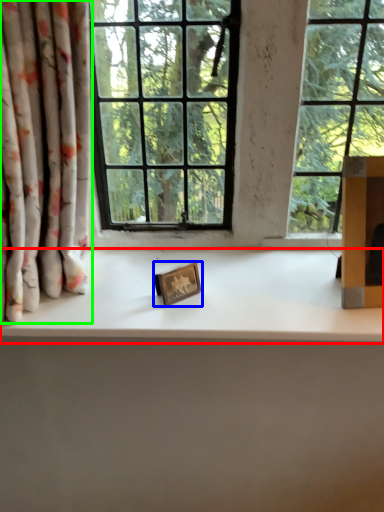
Question: Estimate the real-world distances between objects in this image. Which object is farther from counter top (highlighted by a red box), picture frame (highlighted by a blue box) or curtain (highlighted by a green box)?

Choices:
 (A) picture frame
 (B) curtain

Answer: (B)